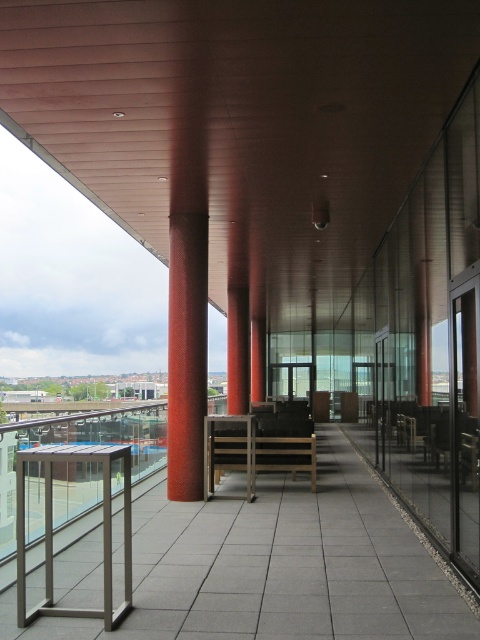
This screenshot has width=480, height=640. What do you see at coordinates (187, 355) in the screenshot?
I see `red textured column at center` at bounding box center [187, 355].

Between point (178, 321) and point (100, 460), which one is positioned behind?

Positioned behind is point (178, 321).

Locate an element on the screen. red textured column at center is located at coordinates (187, 355).